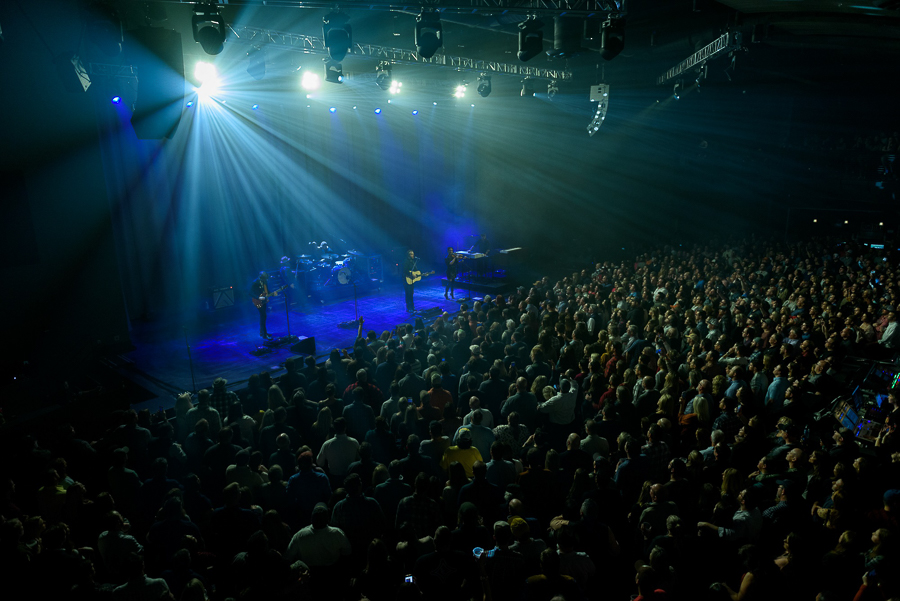
What are the coordinates of `platform on stage` in the screenshot? It's located at (495, 287).